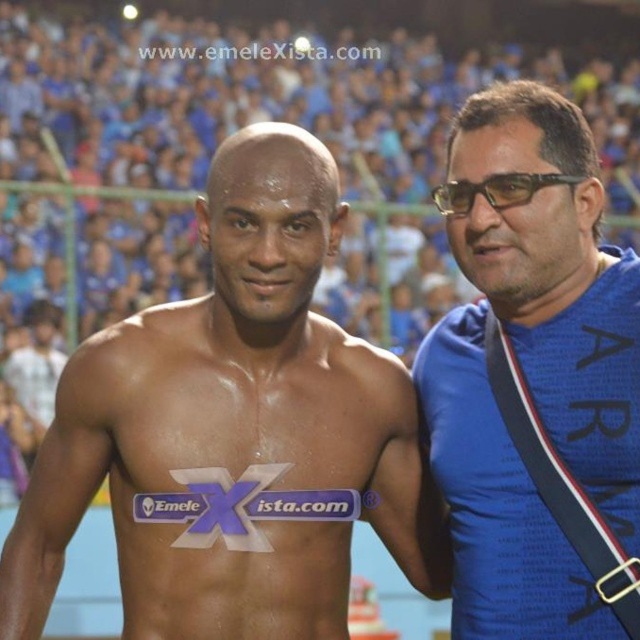
You are a photographer at the sports event. You need to take a closeup photo of the black plastic glasses at right. However, the blue fabric shirt at right is blocking your view. Can you still take the photo without moving the objects?

The blue fabric shirt at right is in front of the black plastic glasses at right, so you cannot take a clear photo of the black plastic glasses at right without moving the blue fabric shirt at right.

You are a photographer at the sports event. You need to capture a closeup of the blue fabric shirt at right and the black plastic glasses at right. Which object should you zoom in more on to ensure it fills the frame properly?

The blue fabric shirt at right is bigger than the black plastic glasses at right, so you should zoom in more on the black plastic glasses at right to ensure it fills the frame properly.